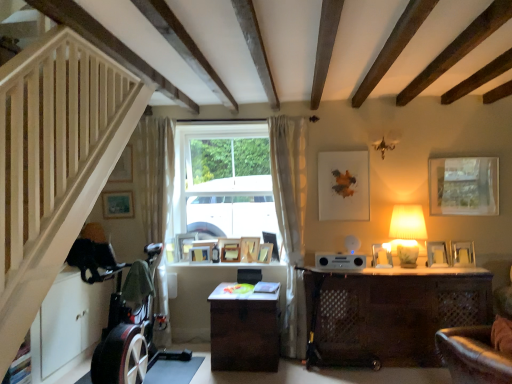
Question: Is the depth of matte silver picture frame at right, placed as the eighth picture frame when sorted from left to right, less than that of silver metallic picture frame at right, positioned as the 9th picture frame in left-to-right order?

Choices:
 (A) yes
 (B) no

Answer: (B)

Question: Is silver metallic picture frame at right, which is the second picture frame in right-to-left order, inside matte silver picture frame at right, the 3th picture frame in the right-to-left sequence?

Choices:
 (A) yes
 (B) no

Answer: (B)

Question: Can you confirm if matte silver picture frame at right, the 3th picture frame in the right-to-left sequence, is smaller than silver metallic picture frame at right, positioned as the 9th picture frame in left-to-right order?

Choices:
 (A) yes
 (B) no

Answer: (A)

Question: From the image's perspective, would you say matte silver picture frame at right, the 3th picture frame in the right-to-left sequence, is shown under silver metallic picture frame at right, which is the second picture frame in right-to-left order?

Choices:
 (A) yes
 (B) no

Answer: (A)

Question: Would you say matte silver picture frame at right, placed as the eighth picture frame when sorted from left to right, is a long distance from silver metallic picture frame at right, which is the second picture frame in right-to-left order?

Choices:
 (A) no
 (B) yes

Answer: (A)

Question: In terms of size, does white sheer curtain at center, which is counted as the 2th curtain, starting from the left, appear bigger or smaller than matte blue picture frame at lower left, which ranks as the second picture frame in left-to-right order?

Choices:
 (A) small
 (B) big

Answer: (B)

Question: Is white sheer curtain at center, arranged as the first curtain when viewed from the right, taller or shorter than matte blue picture frame at lower left, acting as the 9th picture frame starting from the right?

Choices:
 (A) short
 (B) tall

Answer: (B)

Question: Is white sheer curtain at center, arranged as the first curtain when viewed from the right, spatially inside matte blue picture frame at lower left, acting as the 9th picture frame starting from the right, or outside of it?

Choices:
 (A) outside
 (B) inside

Answer: (A)

Question: From a real-world perspective, is white sheer curtain at center, which is counted as the 2th curtain, starting from the left, positioned above or below matte blue picture frame at lower left, which ranks as the second picture frame in left-to-right order?

Choices:
 (A) below
 (B) above

Answer: (A)

Question: Is matte blue picture frame at lower left, acting as the 9th picture frame starting from the right, spatially inside brown woven table at center, or outside of it?

Choices:
 (A) inside
 (B) outside

Answer: (B)

Question: From a real-world perspective, is matte blue picture frame at lower left, which ranks as the second picture frame in left-to-right order, positioned above or below brown woven table at center?

Choices:
 (A) below
 (B) above

Answer: (B)

Question: Is matte blue picture frame at lower left, which ranks as the second picture frame in left-to-right order, taller or shorter than brown woven table at center?

Choices:
 (A) short
 (B) tall

Answer: (A)

Question: Is matte blue picture frame at lower left, which ranks as the second picture frame in left-to-right order, bigger or smaller than brown woven table at center?

Choices:
 (A) small
 (B) big

Answer: (A)

Question: From a real-world perspective, is wooden picture frame at center, placed as the seventh picture frame when sorted from right to left, physically located above or below matte silver picture frame at right, placed as the eighth picture frame when sorted from left to right?

Choices:
 (A) above
 (B) below

Answer: (B)

Question: Is point (207, 248) positioned closer to the camera than point (381, 259)?

Choices:
 (A) closer
 (B) farther

Answer: (B)